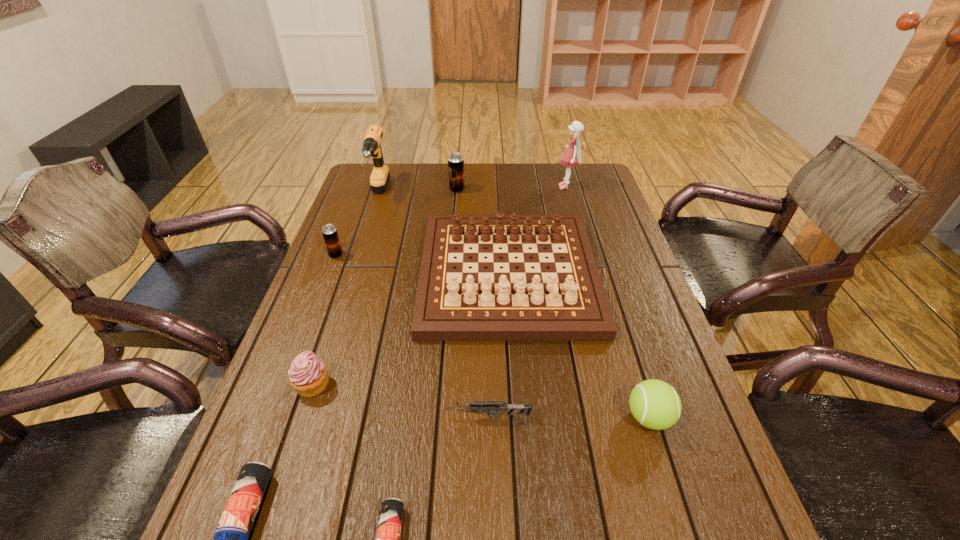
The height and width of the screenshot is (540, 960). In order to click on doll in this screenshot , I will do `click(572, 155)`.

Where is `drill`? drill is located at coordinates (380, 175).

Image resolution: width=960 pixels, height=540 pixels. I want to click on the right black beer can, so click(455, 160).

This screenshot has width=960, height=540. I want to click on the rightmost beer can, so click(455, 160).

You are a GUI agent. You are given a task and a screenshot of the screen. Output one action in this format:
    pyautogui.click(x=<x>, y=<y>)
    Task: Click on the gameboard
    This screenshot has height=540, width=960.
    Given the screenshot: What is the action you would take?
    pyautogui.click(x=462, y=299)

Locate an element on the screen. This screenshot has width=960, height=540. the left black beer can is located at coordinates (329, 231).

Where is `the smaller black beer can`? The width and height of the screenshot is (960, 540). the smaller black beer can is located at coordinates (329, 231).

The image size is (960, 540). I want to click on tennis ball, so click(x=655, y=404).

Locate an element on the screen. This screenshot has width=960, height=540. cupcake is located at coordinates (308, 375).

The image size is (960, 540). I want to click on grey gun, so click(475, 406).